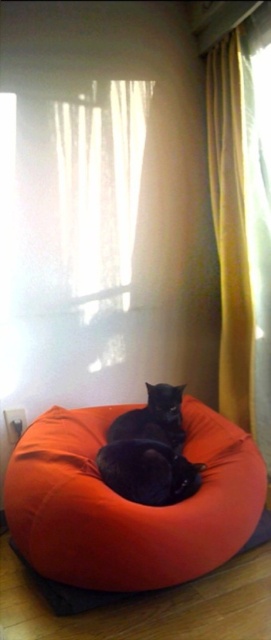
Can you confirm if orange fabric bean bag at center is bigger than black matte cat at center?

Yes, orange fabric bean bag at center is bigger than black matte cat at center.

Can you confirm if orange fabric bean bag at center is taller than black matte cat at center?

Indeed, orange fabric bean bag at center has a greater height compared to black matte cat at center.

Between point (107, 540) and point (168, 477), which one is positioned in front?

Point (107, 540) is in front.

Identify the location of orange fabric bean bag at center. tap(128, 502).

Is yellow fabric curtain at right smaller than orange fabric cat bed at center?

No, yellow fabric curtain at right is not smaller than orange fabric cat bed at center.

How distant is yellow fabric curtain at right from orange fabric cat bed at center?

yellow fabric curtain at right is 1.52 meters away from orange fabric cat bed at center.

Which is behind, point (257, 221) or point (82, 602)?

Positioned behind is point (257, 221).

This screenshot has width=271, height=640. I want to click on yellow fabric curtain at right, so click(x=240, y=236).

Can you confirm if black fur cat at center is shorter than orange fabric cat bed at center?

Incorrect, black fur cat at center's height does not fall short of orange fabric cat bed at center's.

Where is `black fur cat at center`? The image size is (271, 640). black fur cat at center is located at coordinates (153, 419).